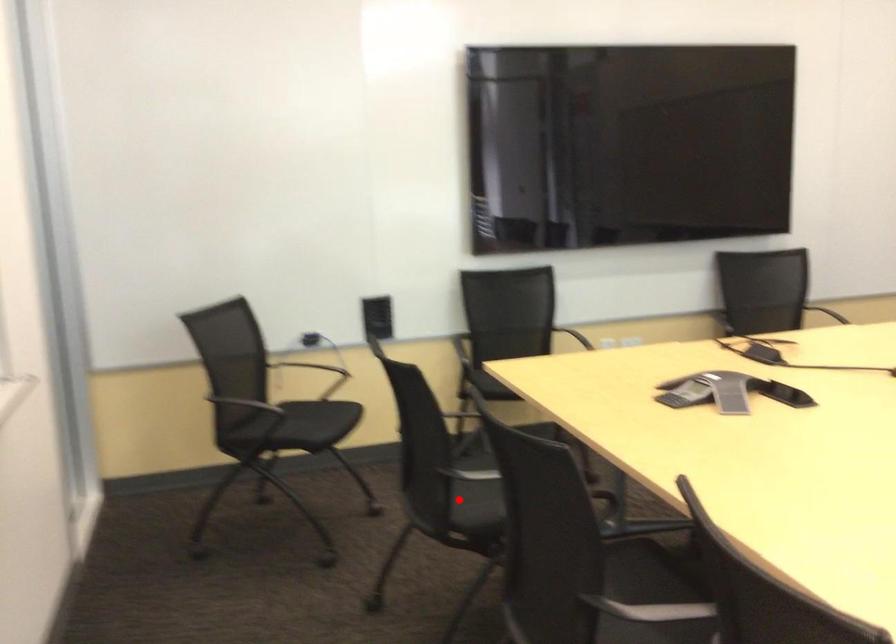
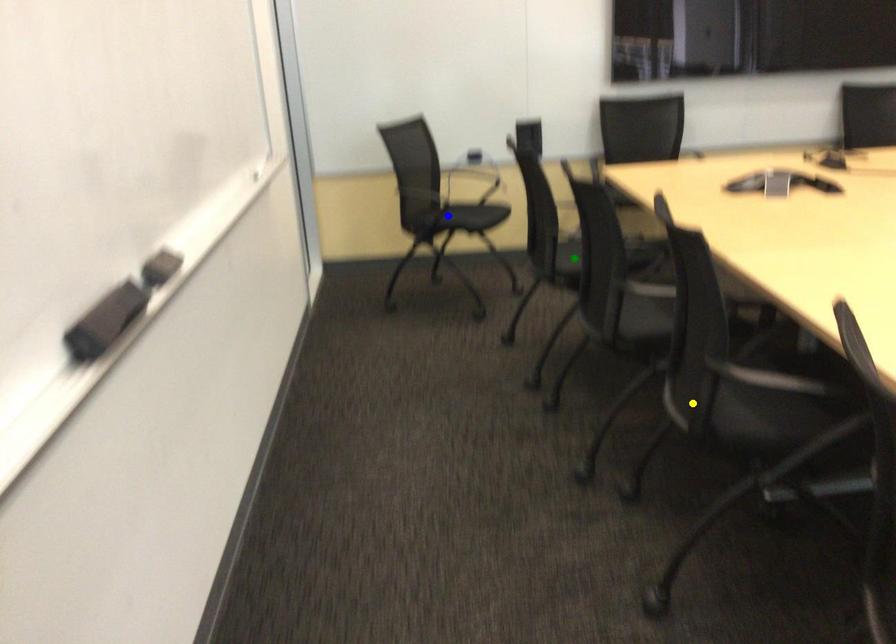
Question: I am providing you with two images of the same scene from different viewpoints. A red point is marked on the first image. You are given multiple points on the second image. Which spot in image 2 lines up with the point in image 1?

Choices:
 (A) green point
 (B) blue point
 (C) yellow point

Answer: (A)